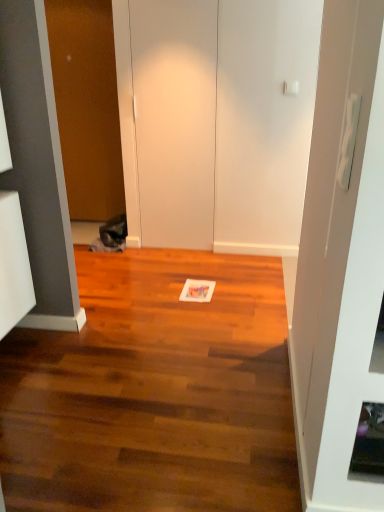
Identify the location of vacant space to the right of white matte door at center, marked as the 1th door in a right-to-left arrangement. This screenshot has width=384, height=512. (217, 257).